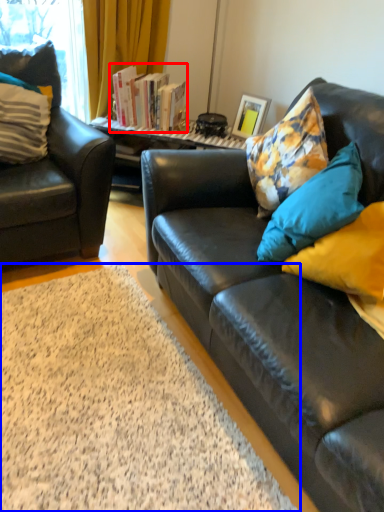
Question: Which object is closer to the camera taking this photo, book (highlighted by a red box) or plain (highlighted by a blue box)?

Choices:
 (A) book
 (B) plain

Answer: (B)